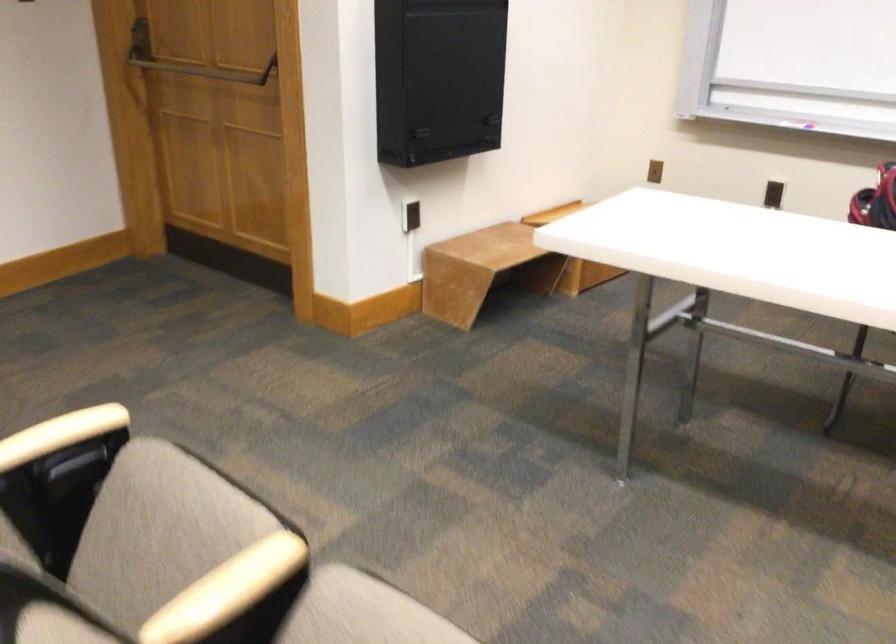
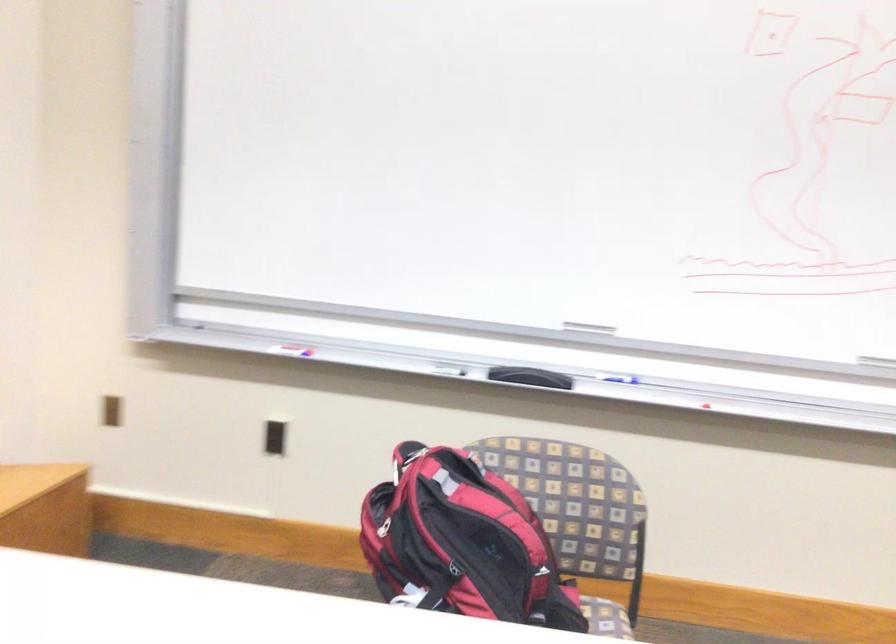
The point at (789,174) is marked in the first image. Where is the corresponding point in the second image?

(273, 438)